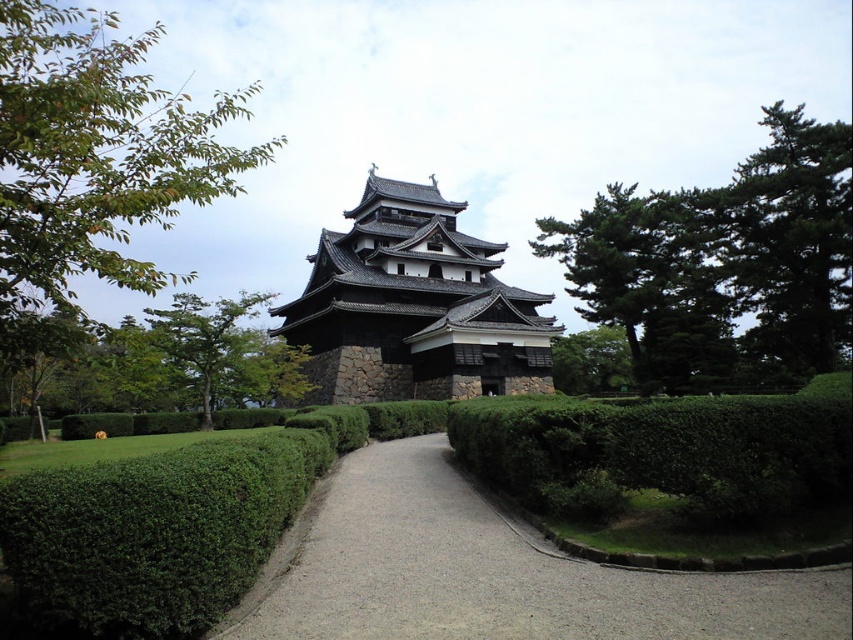
Is point (572, 582) positioned in front of point (643, 326)?

Yes, it is in front of point (643, 326).

Does point (503, 600) come in front of point (693, 374)?

Yes, point (503, 600) is in front of point (693, 374).

This screenshot has height=640, width=853. In order to click on gravel path at center in this screenshot , I will do `click(492, 572)`.

In the scene shown: Can you confirm if gravel path at center is positioned to the left of green leafy tree at upper center?

Yes, gravel path at center is to the left of green leafy tree at upper center.

Who is positioned more to the left, gravel path at center or green leafy tree at upper center?

gravel path at center

Which is behind, point (474, 541) or point (601, 369)?

Positioned behind is point (601, 369).

Where is `gravel path at center`? gravel path at center is located at coordinates (492, 572).

Is point (440, 320) behind point (570, 360)?

No, it is in front of (570, 360).

Is point (289, 330) closer to camera compared to point (567, 394)?

Yes, point (289, 330) is closer to viewer.

Find the location of `dark gray stone pagoda at center`. dark gray stone pagoda at center is located at coordinates (415, 307).